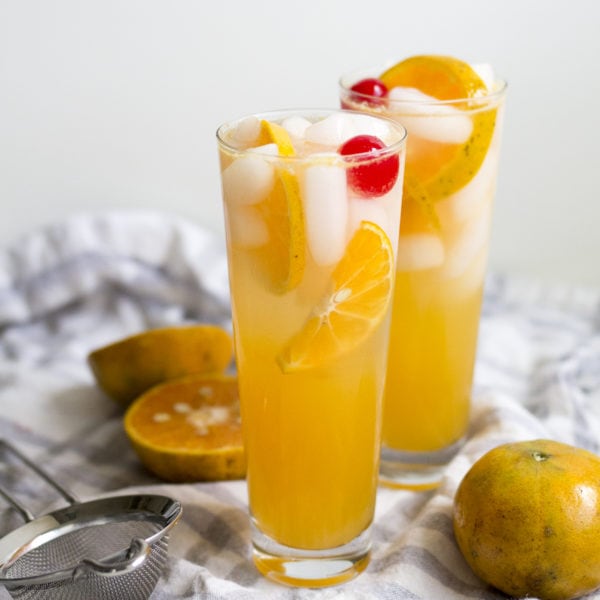
I want to click on stainer's metallic handles, so click(x=24, y=509), click(x=60, y=486).